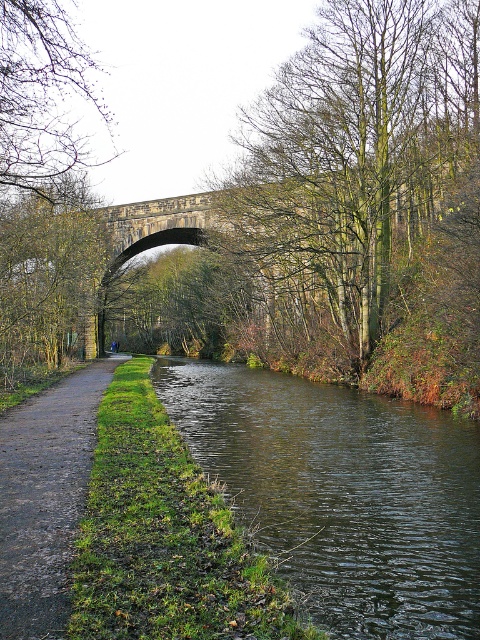
You are a gardener planning to plant a new tree in the canal area. Given the presence of the green leafy tree at center and the dull brown dirt path at lower left, which location would be more suitable for planting a new tree based on their current sizes?

The green leafy tree at center has a larger size compared to the dull brown dirt path at lower left, so planting a new tree near the green leafy tree at center would be more suitable as it indicates sufficient space and possibly better growing conditions.

You are a tourist standing on the stone arch bridge in the scene. Looking down, you see the dark green water at lower center and notice the bare branches at upper left. Which object is positioned higher from your viewpoint?

The bare branches at upper left are positioned higher than the dark green water at lower center from your viewpoint.